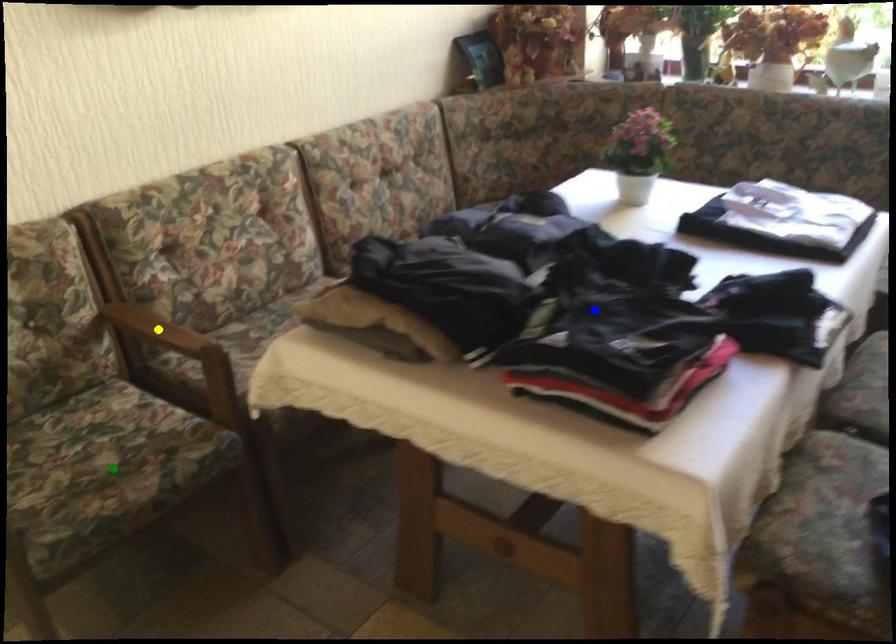
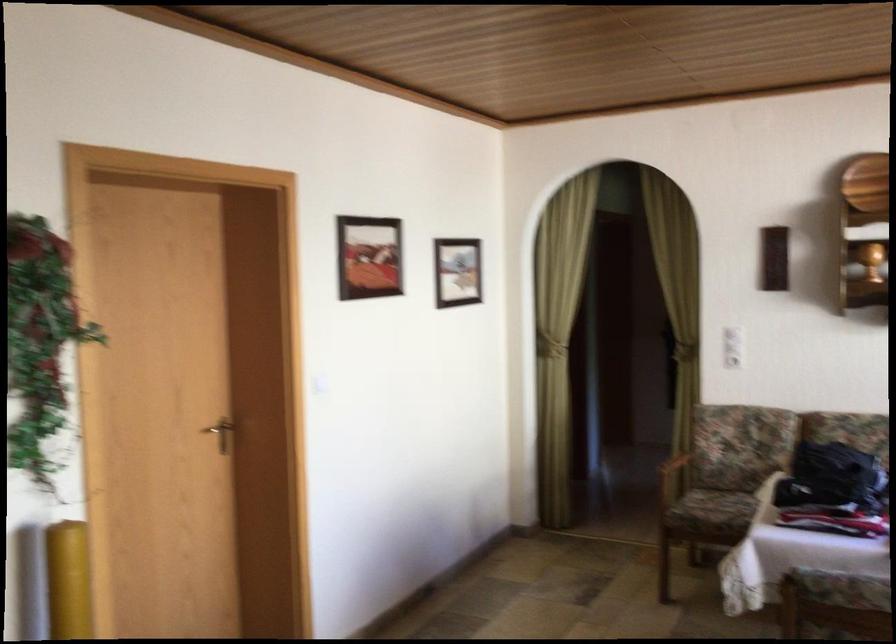
I am providing you with two images of the same scene from different viewpoints. Three points are marked in image1. Which point corresponds to a part or object that is occluded in image2?In image1, three points are marked. Which of them correspond to a part or object that is occluded in image2?Among the three points shown in image1, which one corresponds to a part or object that is no longer visible due to occlusion in image2?

yellow point cannot be seen in image2.